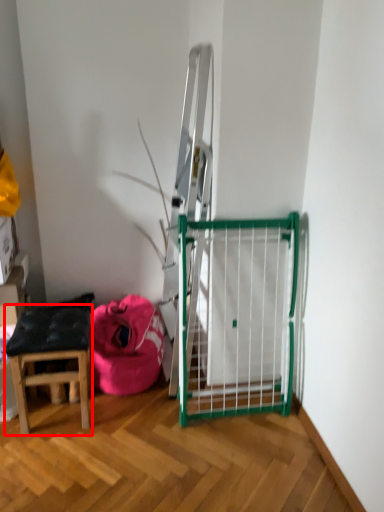
Question: From the image's perspective, considering the relative positions of stool (annotated by the red box) and bean bag chair in the image provided, where is stool (annotated by the red box) located with respect to the staircase?

Choices:
 (A) below
 (B) above

Answer: (A)